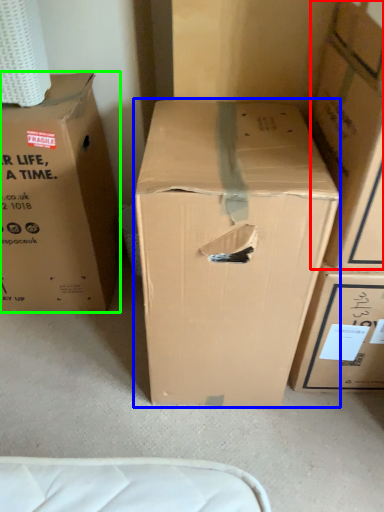
Question: Estimate the real-world distances between objects in this image. Which object is farther from box (highlighted by a red box), box (highlighted by a blue box) or box (highlighted by a green box)?

Choices:
 (A) box
 (B) box

Answer: (B)